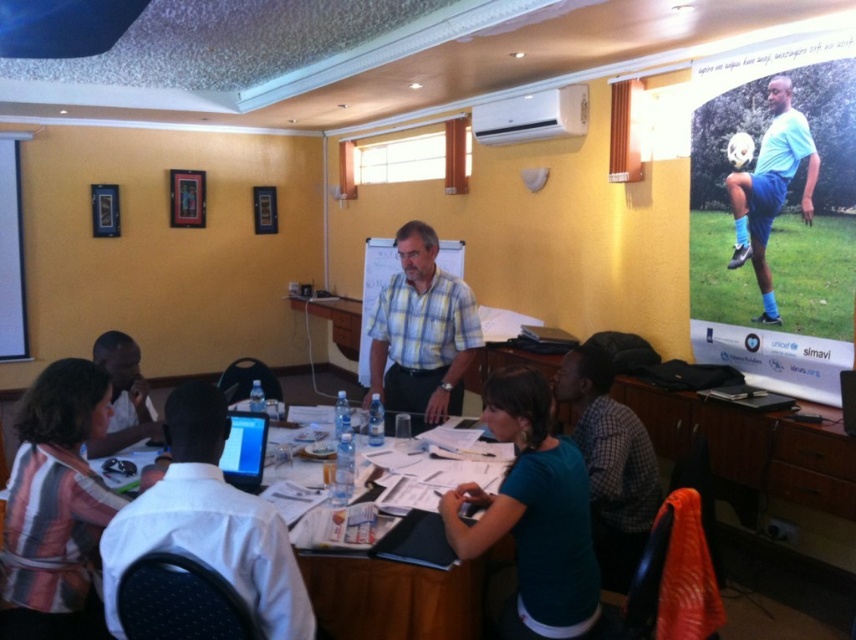
Consider the image. You are an attendee at this meeting and need to identify the two people wearing shirts with different patterns. Which of the two shirts, the striped fabric shirt at lower left or the teal fabric shirt at center, is smaller in size?

The striped fabric shirt at lower left is smaller than the teal fabric shirt at center.

You are a person who is 1.8 meters tall and wants to walk from the striped fabric shirt at lower left to the teal fabric shirt at center. Is there enough space between them for you to pass through comfortably?

The distance between the striped fabric shirt at lower left and the teal fabric shirt at center is 1.16 meters. Since the required space for a person to pass comfortably is typically around 0.9 meters, the 1.16 meters is sufficient. Therefore, you can comfortably walk through the space between them.